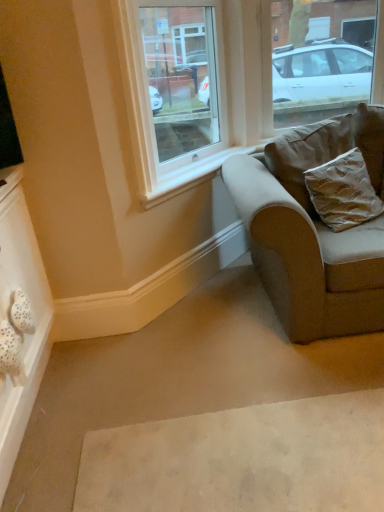
Identify the location of beige fabric couch at right. The image size is (384, 512). tap(313, 231).

The image size is (384, 512). What are the coordinates of `gold textured pillow at right` in the screenshot? It's located at (343, 192).

The image size is (384, 512). In order to click on clear glass window at upper center, marked as the second window in a right-to-left arrangement in this screenshot , I will do `click(174, 90)`.

Is the position of white fabric drawer at lower left more distant than that of clear glass window at upper center, marked as the second window in a right-to-left arrangement?

No, white fabric drawer at lower left is in front of clear glass window at upper center, marked as the second window in a right-to-left arrangement.

Is point (31, 232) in front of point (146, 59)?

Yes, it is.

Locate an element on the screen. This screenshot has width=384, height=512. the 1st window positioned above the white fabric drawer at lower left (from the image's perspective) is located at coordinates (174, 90).

From the image's perspective, which is below, white fabric drawer at lower left or clear glass window at upper center, marked as the second window in a right-to-left arrangement?

From the image's view, white fabric drawer at lower left is below.

How much distance is there between clear glass window at upper right, acting as the second window starting from the left, and white fabric drawer at lower left?

clear glass window at upper right, acting as the second window starting from the left, is 2.56 meters from white fabric drawer at lower left.

Is white fabric drawer at lower left inside clear glass window at upper right, the 1th window from the right?

No, white fabric drawer at lower left is not surrounded by clear glass window at upper right, the 1th window from the right.

How different are the orientations of clear glass window at upper right, acting as the second window starting from the left, and white fabric drawer at lower left in degrees?

clear glass window at upper right, acting as the second window starting from the left, and white fabric drawer at lower left are facing 91.2 degrees away from each other.

Does point (307, 23) appear closer or farther from the camera than point (3, 322)?

Point (307, 23) is positioned farther from the camera compared to point (3, 322).

Is beige fabric couch at right positioned far away from clear glass window at upper right, the 1th window from the right?

Indeed, beige fabric couch at right is not near clear glass window at upper right, the 1th window from the right.

Is beige fabric couch at right turned away from clear glass window at upper right, the 1th window from the right?

No, beige fabric couch at right is not facing away from clear glass window at upper right, the 1th window from the right.

Who is bigger, beige fabric couch at right or clear glass window at upper right, acting as the second window starting from the left?

Bigger between the two is beige fabric couch at right.

Identify the location of studio couch located on the left of clear glass window at upper right, the 1th window from the right. (313, 231).

Can you tell me how much white fabric drawer at lower left and gold textured pillow at right differ in facing direction?

There is a 65.9-degree angle between the facing directions of white fabric drawer at lower left and gold textured pillow at right.

Is the position of white fabric drawer at lower left more distant than that of gold textured pillow at right?

No, it is in front of gold textured pillow at right.

Who is shorter, white fabric drawer at lower left or gold textured pillow at right?

white fabric drawer at lower left.

In the scene shown: Is white fabric drawer at lower left touching gold textured pillow at right?

No, white fabric drawer at lower left is not in contact with gold textured pillow at right.

Is point (361, 85) closer to camera compared to point (365, 268)?

No.

Image resolution: width=384 pixels, height=512 pixels. I want to click on studio couch on the left side of clear glass window at upper right, acting as the second window starting from the left, so click(313, 231).

From the image's perspective, is clear glass window at upper right, the 1th window from the right, located above beige fabric couch at right?

Indeed, from the image's perspective, clear glass window at upper right, the 1th window from the right, is shown above beige fabric couch at right.

Does gold textured pillow at right have a greater height compared to beige fabric couch at right?

Incorrect, the height of gold textured pillow at right is not larger of that of beige fabric couch at right.

Between gold textured pillow at right and beige fabric couch at right, which one appears on the left side from the viewer's perspective?

From the viewer's perspective, beige fabric couch at right appears more on the left side.

Is gold textured pillow at right not near beige fabric couch at right?

Actually, gold textured pillow at right and beige fabric couch at right are a little close together.

Which object is further away from the camera taking this photo, gold textured pillow at right or beige fabric couch at right?

gold textured pillow at right is further from the camera.

Is clear glass window at upper right, acting as the second window starting from the left, situated inside gold textured pillow at right or outside?

clear glass window at upper right, acting as the second window starting from the left, lies outside gold textured pillow at right.

Would you consider clear glass window at upper right, acting as the second window starting from the left, to be distant from gold textured pillow at right?

Yes.

Looking at this image, from a real-world perspective, is clear glass window at upper right, the 1th window from the right, physically located above or below gold textured pillow at right?

clear glass window at upper right, the 1th window from the right, is situated higher than gold textured pillow at right in the real world.

How many degrees apart are the facing directions of clear glass window at upper right, the 1th window from the right, and gold textured pillow at right?

25.3 degrees.

From the image's perspective, starting from the white fabric drawer at lower left, which window is the 1st one above? Please provide its 2D coordinates.

[(174, 90)]

Which window is the 2nd one when counting from the right side of the white fabric drawer at lower left? Please provide its 2D coordinates.

[(325, 57)]

From the image, which object appears to be nearer to white fabric drawer at lower left, gold textured pillow at right or beige fabric couch at right?

Among the two, beige fabric couch at right is located nearer to white fabric drawer at lower left.

Which object lies nearer to the anchor point clear glass window at upper right, the 1th window from the right, white fabric drawer at lower left or clear glass window at upper center, the 1th window when ordered from left to right?

The object closer to clear glass window at upper right, the 1th window from the right, is clear glass window at upper center, the 1th window when ordered from left to right.

Looking at the image, which one is located further to gold textured pillow at right, clear glass window at upper right, acting as the second window starting from the left, or clear glass window at upper center, the 1th window when ordered from left to right?

clear glass window at upper center, the 1th window when ordered from left to right, lies further to gold textured pillow at right than the other object.

Looking at the image, which one is located closer to clear glass window at upper center, marked as the second window in a right-to-left arrangement, clear glass window at upper right, acting as the second window starting from the left, or white fabric drawer at lower left?

clear glass window at upper right, acting as the second window starting from the left.

Which object lies nearer to the anchor point clear glass window at upper center, the 1th window when ordered from left to right, clear glass window at upper right, the 1th window from the right, or beige fabric couch at right?

The object closer to clear glass window at upper center, the 1th window when ordered from left to right, is clear glass window at upper right, the 1th window from the right.

Based on the photo, estimate the real-world distances between objects in this image. Which object is further from clear glass window at upper center, marked as the second window in a right-to-left arrangement, beige fabric couch at right or gold textured pillow at right?

Among the two, beige fabric couch at right is located further to clear glass window at upper center, marked as the second window in a right-to-left arrangement.

From the picture: Which object lies nearer to the anchor point clear glass window at upper center, marked as the second window in a right-to-left arrangement, white fabric drawer at lower left or gold textured pillow at right?

gold textured pillow at right lies closer to clear glass window at upper center, marked as the second window in a right-to-left arrangement, than the other object.

Estimate the real-world distances between objects in this image. Which object is closer to beige fabric couch at right, clear glass window at upper right, the 1th window from the right, or clear glass window at upper center, marked as the second window in a right-to-left arrangement?

The object closer to beige fabric couch at right is clear glass window at upper right, the 1th window from the right.

You are a GUI agent. You are given a task and a screenshot of the screen. Output one action in this format:
    pyautogui.click(x=<x>, y=<y>)
    Task: Click on the window between white fabric drawer at lower left and beige fabric couch at right in the horizontal direction
    
    Given the screenshot: What is the action you would take?
    pyautogui.click(x=174, y=90)

The height and width of the screenshot is (512, 384). Find the location of `studio couch located between clear glass window at upper center, the 1th window when ordered from left to right, and gold textured pillow at right in the left-right direction`. studio couch located between clear glass window at upper center, the 1th window when ordered from left to right, and gold textured pillow at right in the left-right direction is located at coordinates (313, 231).

This screenshot has height=512, width=384. Identify the location of studio couch between white fabric drawer at lower left and gold textured pillow at right from left to right. (313, 231).

At what (x,y) coordinates should I click in order to perform the action: click on pillow situated between white fabric drawer at lower left and clear glass window at upper right, acting as the second window starting from the left, from left to right. Please return your answer as a coordinate pair (x, y). The height and width of the screenshot is (512, 384). Looking at the image, I should click on (343, 192).